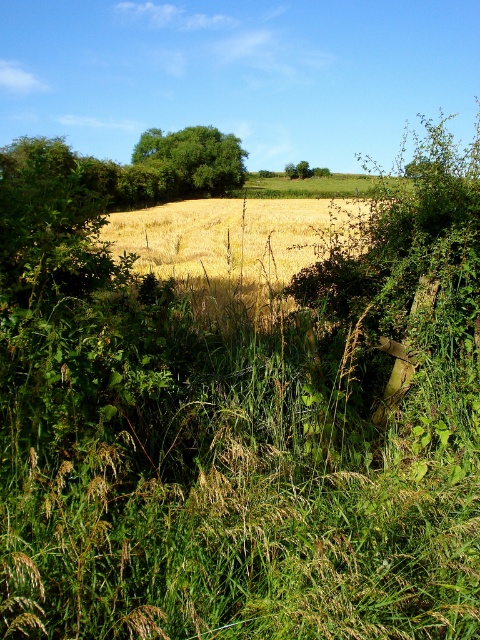
Question: Is golden dry grass at center in front of green leafy tree at center?

Choices:
 (A) no
 (B) yes

Answer: (B)

Question: From the image, what is the correct spatial relationship of golden dry grass at center in relation to green leafy tree at center?

Choices:
 (A) above
 (B) below

Answer: (B)

Question: Does golden dry grass at center have a larger size compared to green leafy tree at center?

Choices:
 (A) yes
 (B) no

Answer: (A)

Question: Among these objects, which one is farthest from the camera?

Choices:
 (A) green leafy tree at center
 (B) golden dry grass at center

Answer: (A)

Question: Which point is closer to the camera?

Choices:
 (A) (148, 134)
 (B) (336, 228)

Answer: (B)